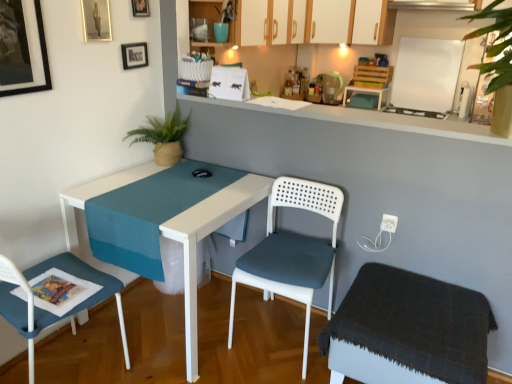
Describe the element at coordinates (221, 32) in the screenshot. I see `teal fabric at upper center` at that location.

This screenshot has width=512, height=384. Find the location of `matte black picture frame at upper left, marked as the 3th picture frame in a left-to-right arrangement`. matte black picture frame at upper left, marked as the 3th picture frame in a left-to-right arrangement is located at coordinates (134, 55).

I want to click on blue fabric chair at lower left, the first chair from the left, so click(x=50, y=312).

Image resolution: width=512 pixels, height=384 pixels. I want to click on matte white cabinet at upper center, marked as the first cabinetry in a left-to-right arrangement, so click(x=210, y=21).

The image size is (512, 384). What do you see at coordinates (210, 21) in the screenshot? I see `matte white cabinet at upper center, marked as the 3th cabinetry in a right-to-left arrangement` at bounding box center [210, 21].

Where is `white plastic table at center`? white plastic table at center is located at coordinates (205, 236).

This screenshot has width=512, height=384. What do you see at coordinates (205, 236) in the screenshot?
I see `white plastic table at center` at bounding box center [205, 236].

You are a GUI agent. You are given a task and a screenshot of the screen. Output one action in this format:
    pyautogui.click(x=<x>, y=<y>)
    Task: Click on the white plastic chair at center, which appears as the 2th chair when viewed from the left
    This screenshot has width=512, height=384.
    Given the screenshot: What is the action you would take?
    pyautogui.click(x=292, y=251)

Where is `teal fabric at upper center`? The image size is (512, 384). teal fabric at upper center is located at coordinates (221, 32).

I want to click on the 1st picture frame directly beneath the white matte cabinet at upper center, placed as the 1th cabinetry when sorted from back to front (from a real-world perspective), so click(x=96, y=20).

Which is in front, point (371, 18) or point (95, 9)?

The point (95, 9) is more forward.

Who is shorter, white matte cabinet at upper center, placed as the 1th cabinetry when sorted from back to front, or matte gold picture frame at upper left, the third picture frame when ordered from back to front?

matte gold picture frame at upper left, the third picture frame when ordered from back to front.

From the image's perspective, who appears lower, white matte cabinet at upper center, which is counted as the 3th cabinetry, starting from the front, or matte gold picture frame at upper left, the third picture frame when ordered from back to front?

matte gold picture frame at upper left, the third picture frame when ordered from back to front, appears lower in the image.

In the scene shown: From the image's perspective, does white matte board at upper right appear lower than white plastic chair at center, which appears as the 2th chair when viewed from the left?

Actually, white matte board at upper right appears above white plastic chair at center, which appears as the 2th chair when viewed from the left, in the image.

Does point (407, 99) appear closer or farther from the camera than point (286, 194)?

Point (407, 99) is farther from the camera than point (286, 194).

In terms of width, does white matte board at upper right look wider or thinner when compared to white plastic chair at center, which is the 1th chair in right-to-left order?

Clearly, white matte board at upper right has less width compared to white plastic chair at center, which is the 1th chair in right-to-left order.

Find the location of a particular element. Image resolution: width=512 pixels, height=384 pixels. the 1st chair in front of the white matte board at upper right is located at coordinates (292, 251).

Are teal fabric at upper center and matte black picture frame at upper left, acting as the 1th picture frame starting from the front, making contact?

No.

In the scene shown: Is teal fabric at upper center wider than matte black picture frame at upper left, acting as the 1th picture frame starting from the front?

Correct, the width of teal fabric at upper center exceeds that of matte black picture frame at upper left, acting as the 1th picture frame starting from the front.

Is matte black picture frame at upper left, placed as the first picture frame when sorted from left to right, at the back of teal fabric at upper center?

No, teal fabric at upper center is not facing away from matte black picture frame at upper left, placed as the first picture frame when sorted from left to right.

Between teal fabric at upper center and matte black picture frame at upper left, the 4th picture frame in the right-to-left sequence, which one has larger size?

Bigger between the two is matte black picture frame at upper left, the 4th picture frame in the right-to-left sequence.

Which point is more distant from viewer, (x=142, y=55) or (x=16, y=86)?

The point (x=142, y=55) is behind.

Is the depth of matte black picture frame at upper left, which appears as the second picture frame when viewed from the right, less than that of matte black picture frame at upper left, the 4th picture frame in the right-to-left sequence?

No, matte black picture frame at upper left, which appears as the second picture frame when viewed from the right, is further to the viewer.

From a real-world perspective, is matte black picture frame at upper left, arranged as the fourth picture frame when viewed from the front, physically located above or below matte black picture frame at upper left, marked as the 4th picture frame in a back-to-front arrangement?

Clearly, from a real-world perspective, matte black picture frame at upper left, arranged as the fourth picture frame when viewed from the front, is below matte black picture frame at upper left, marked as the 4th picture frame in a back-to-front arrangement.

How much distance is there between matte black picture frame at upper left, which appears as the second picture frame when viewed from the right, and matte black picture frame at upper left, acting as the 1th picture frame starting from the front?

matte black picture frame at upper left, which appears as the second picture frame when viewed from the right, and matte black picture frame at upper left, acting as the 1th picture frame starting from the front, are 53.85 centimeters apart from each other.

Is white matte board at upper right positioned beyond the bounds of white matte cabinet at upper center, which is the 2th cabinetry in right-to-left order?

Yes, white matte board at upper right is outside of white matte cabinet at upper center, which is the 2th cabinetry in right-to-left order.

Considering the positions of objects white matte board at upper right and white matte cabinet at upper center, which is the 2th cabinetry in right-to-left order, in the image provided, who is in front, white matte board at upper right or white matte cabinet at upper center, which is the 2th cabinetry in right-to-left order,?

white matte cabinet at upper center, which is the 2th cabinetry in right-to-left order, is closer to the camera.

From a real-world perspective, who is located higher, white matte board at upper right or white matte cabinet at upper center, which appears as the second cabinetry when viewed from the left?

From a 3D spatial view, white matte cabinet at upper center, which appears as the second cabinetry when viewed from the left, is above.

Is white matte board at upper right next to white matte cabinet at upper center, which is the second cabinetry from back to front?

No, white matte board at upper right is not beside white matte cabinet at upper center, which is the second cabinetry from back to front.

In the scene shown: Between green woven plant at upper left and dark gray fabric stool at lower right, which one has more height?

dark gray fabric stool at lower right.

Is green woven plant at upper left in contact with dark gray fabric stool at lower right?

green woven plant at upper left and dark gray fabric stool at lower right are not in contact.

Which of these two, green woven plant at upper left or dark gray fabric stool at lower right, is wider?

Wider between the two is dark gray fabric stool at lower right.

Is green woven plant at upper left smaller than dark gray fabric stool at lower right?

Correct, green woven plant at upper left occupies less space than dark gray fabric stool at lower right.

Does white plastic table at center appear on the left side of white matte cabinet at upper center, which appears as the second cabinetry when viewed from the left?

Correct, you'll find white plastic table at center to the left of white matte cabinet at upper center, which appears as the second cabinetry when viewed from the left.

Would you say white plastic table at center is a long distance from white matte cabinet at upper center, which is the 2th cabinetry in right-to-left order?

white plastic table at center is positioned a significant distance from white matte cabinet at upper center, which is the 2th cabinetry in right-to-left order.

Can you tell me how much white plastic table at center and white matte cabinet at upper center, which is the second cabinetry from back to front, differ in facing direction?

There is a 0.139-degree angle between the facing directions of white plastic table at center and white matte cabinet at upper center, which is the second cabinetry from back to front.

Is white plastic table at center completely or partially outside of white matte cabinet at upper center, which is counted as the 2th cabinetry, starting from the front?

Yes, white plastic table at center is outside of white matte cabinet at upper center, which is counted as the 2th cabinetry, starting from the front.

Where is `cabinetry that is the 3rd one when counting rightward from the matte gold picture frame at upper left, the 2th picture frame when ordered from left to right`? This screenshot has height=384, width=512. cabinetry that is the 3rd one when counting rightward from the matte gold picture frame at upper left, the 2th picture frame when ordered from left to right is located at coordinates (373, 23).

The width and height of the screenshot is (512, 384). Find the location of `the 2nd chair directly beneath the white matte board at upper right (from a real-world perspective)`. the 2nd chair directly beneath the white matte board at upper right (from a real-world perspective) is located at coordinates (292, 251).

Estimate the real-world distances between objects in this image. Which object is closer to white matte board at upper right, matte black picture frame at upper left, which is the 1th picture frame from back to front, or dark gray fabric stool at lower right?

dark gray fabric stool at lower right.

Considering their positions, is matte black picture frame at upper left, which appears as the second picture frame when viewed from the right, positioned closer to matte black picture frame at upper left, placed as the first picture frame when sorted from left to right, than white matte board at upper right?

The object closer to matte black picture frame at upper left, placed as the first picture frame when sorted from left to right, is matte black picture frame at upper left, which appears as the second picture frame when viewed from the right.

Looking at the image, which one is located closer to metallic gold picture frame at upper center, the fourth picture frame when ordered from left to right, green woven plant at upper left or teal fabric at upper center?

teal fabric at upper center lies closer to metallic gold picture frame at upper center, the fourth picture frame when ordered from left to right, than the other object.

Estimate the real-world distances between objects in this image. Which object is closer to matte black picture frame at upper left, placed as the first picture frame when sorted from left to right, matte gold picture frame at upper left, which is the second picture frame from front to back, or white matte board at upper right?

matte gold picture frame at upper left, which is the second picture frame from front to back, lies closer to matte black picture frame at upper left, placed as the first picture frame when sorted from left to right, than the other object.

When comparing their distances from white matte cabinet at upper center, which is the second cabinetry from back to front, does dark gray fabric stool at lower right or matte black picture frame at upper left, acting as the 1th picture frame starting from the front, seem further?

dark gray fabric stool at lower right lies further to white matte cabinet at upper center, which is the second cabinetry from back to front, than the other object.

When comparing their distances from dark gray fabric stool at lower right, does matte black picture frame at upper left, arranged as the fourth picture frame when viewed from the front, or white plastic chair at center, which appears as the 2th chair when viewed from the left, seem further?

matte black picture frame at upper left, arranged as the fourth picture frame when viewed from the front, is further to dark gray fabric stool at lower right.

Estimate the real-world distances between objects in this image. Which object is further from white matte board at upper right, white matte cabinet at upper center, which ranks as the third cabinetry in left-to-right order, or dark gray fabric stool at lower right?

dark gray fabric stool at lower right.

Considering their positions, is matte white cabinet at upper center, arranged as the first cabinetry when viewed from the front, positioned closer to matte black picture frame at upper left, marked as the 3th picture frame in a left-to-right arrangement, than green woven plant at upper left?

Based on the image, green woven plant at upper left appears to be nearer to matte black picture frame at upper left, marked as the 3th picture frame in a left-to-right arrangement.

Locate an element on the screen. The width and height of the screenshot is (512, 384). table between metallic gold picture frame at upper center, which appears as the 2th picture frame when viewed from the back, and white plastic chair at center, which appears as the 2th chair when viewed from the left, in the up-down direction is located at coordinates (205, 236).

Locate an element on the screen. houseplant between metallic gold picture frame at upper center, the fourth picture frame when ordered from left to right, and white plastic chair at center, which is the 1th chair in right-to-left order, in the vertical direction is located at coordinates (163, 137).

The height and width of the screenshot is (384, 512). I want to click on cabinetry located between matte black picture frame at upper left, the 4th picture frame in the right-to-left sequence, and white matte cabinet at upper center, which is the second cabinetry from back to front, in the depth direction, so click(x=210, y=21).

This screenshot has width=512, height=384. In order to click on houseplant between matte white cabinet at upper center, marked as the 3th cabinetry in a right-to-left arrangement, and white plastic chair at center, which appears as the 2th chair when viewed from the left, from top to bottom in this screenshot , I will do `click(163, 137)`.